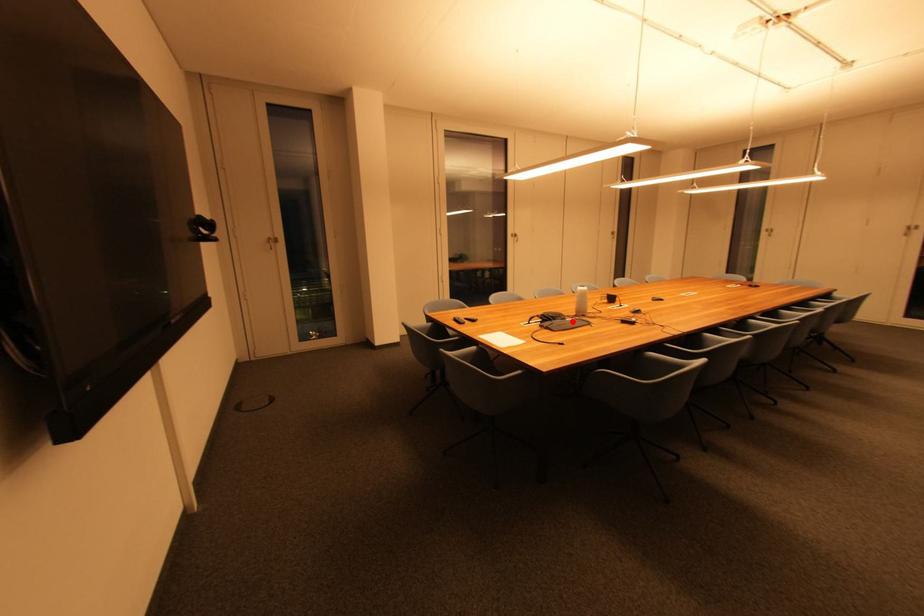
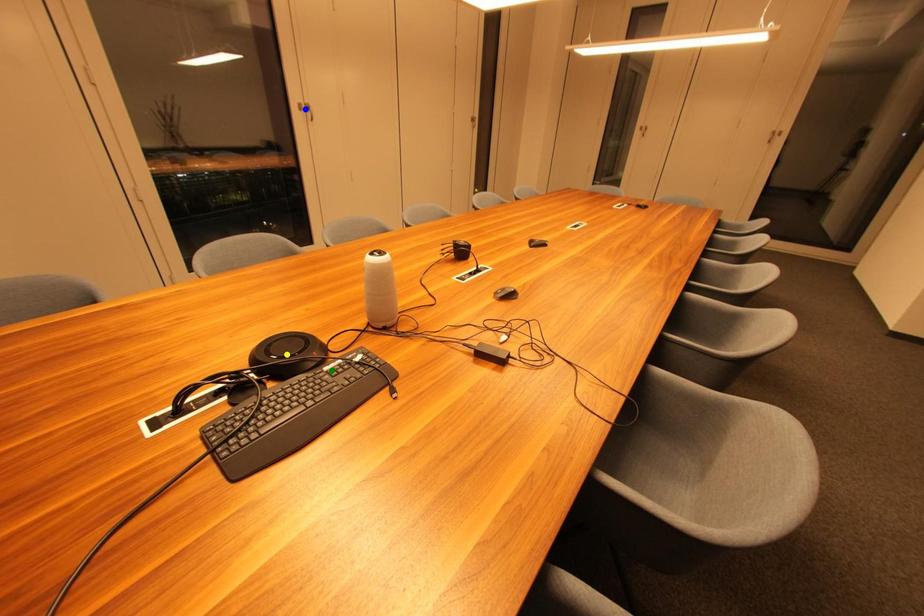
Question: I am providing you with two images of the same scene from different viewpoints. A red point is marked on the first image. You are given multiple points on the second image. Which point in image 2 represents the same 3d spot as the red point in image 1?

Choices:
 (A) blue point
 (B) green point
 (C) yellow point

Answer: (B)